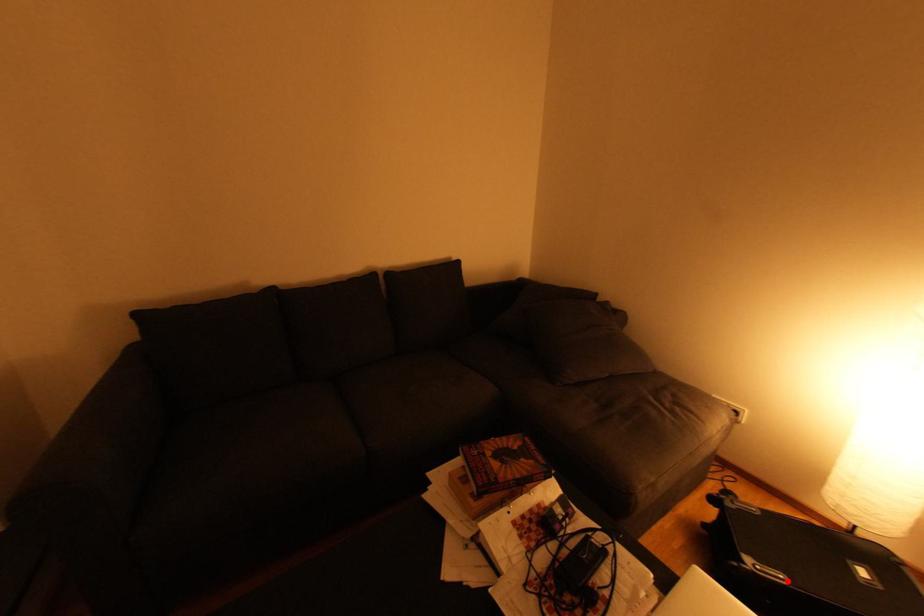
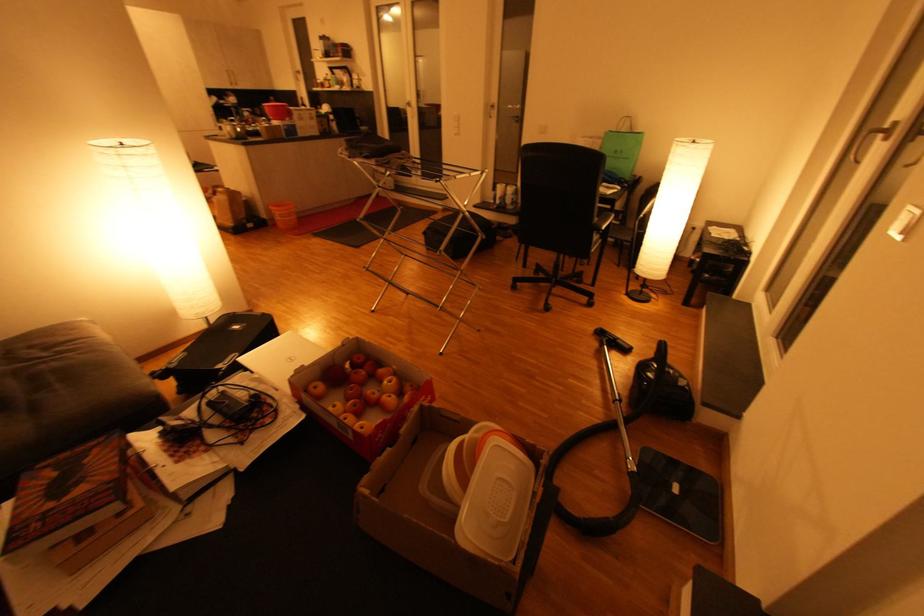
Locate, in the second image, the point that corresponds to the highlighted location in the first image.

(238, 357)